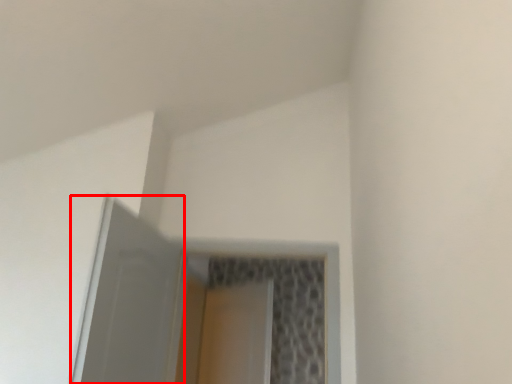
Question: From the image's perspective, what is the correct spatial relationship of screen door (annotated by the red box) in relation to screen door?

Choices:
 (A) below
 (B) above

Answer: (B)